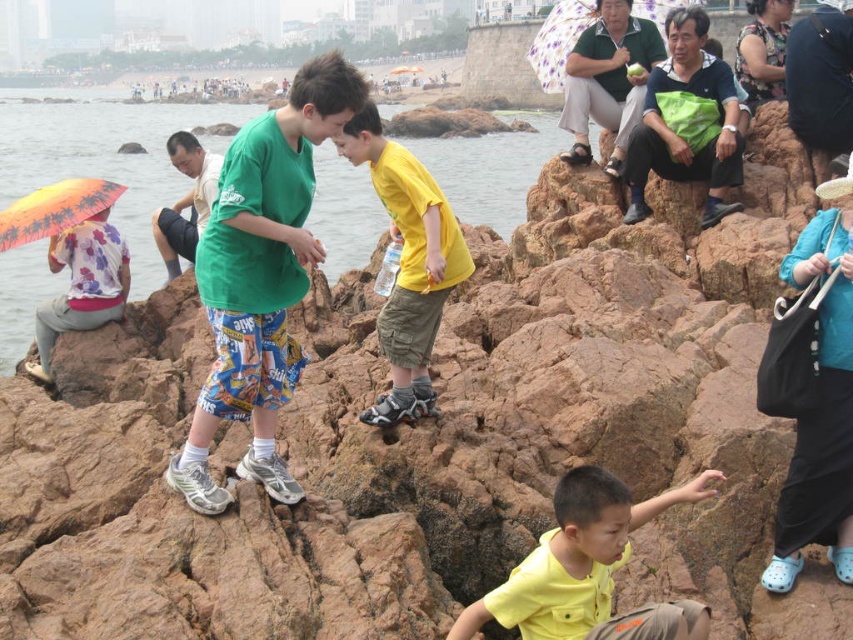
Looking at this image, you are a photographer at the seaside scene. You want to capture a photo of the yellow matte shirt at center without any shadows. Since the sun is bright, you decide to use the floral fabric umbrella at left to cast a shadow. Will the umbrella block the sunlight on the shirt?

The yellow matte shirt at center is positioned under the floral fabric umbrella at left, so the umbrella is already casting a shadow over it. Therefore, the umbrella will block the sunlight on the yellow matte shirt at center.

You are standing at the point marked by the coordinates point (407,264). Looking around, you see a child in yellow matte shorts at center. Which direction should you walk to face the child in yellow matte shorts at center?

You are already at the point marked by the coordinates point (407,264), which represents the location of the child in yellow matte shorts at center. Therefore, you are already facing the child in yellow matte shorts at center.

You are planning to bring an umbrella to the rocky seaside location. You see the floral fabric umbrella at left and the floral fabric umbrella at upper center. Which one is more suitable for providing shade to a group of three people?

The floral fabric umbrella at upper center is more suitable for providing shade to a group of three people because it has a larger size compared to the floral fabric umbrella at left.